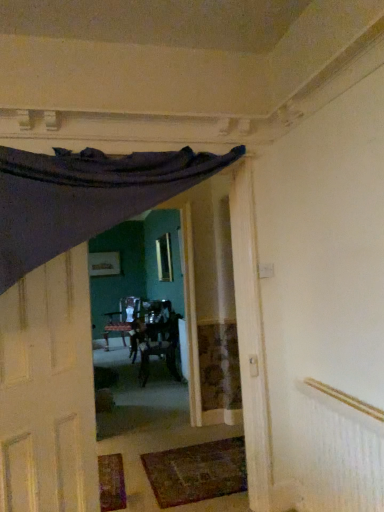
This screenshot has width=384, height=512. I want to click on clear glass window at center, so click(x=164, y=258).

What do you see at coordinates (342, 450) in the screenshot?
I see `white textured radiator at upper right` at bounding box center [342, 450].

I want to click on wooden textured chair at center, so click(156, 341).

Based on their sizes in the image, would you say white textured radiator at upper right is bigger or smaller than dark brown woven mat at lower center?

Clearly, white textured radiator at upper right is larger in size than dark brown woven mat at lower center.

Looking at this image, is white textured radiator at upper right not close to dark brown woven mat at lower center?

Yes, white textured radiator at upper right and dark brown woven mat at lower center are quite far apart.

You are a GUI agent. You are given a task and a screenshot of the screen. Output one action in this format:
    pyautogui.click(x=<x>, y=<y>)
    Task: Click on the mat below the white textured radiator at upper right (from the image's perspective)
    Image resolution: width=384 pixels, height=512 pixels.
    Given the screenshot: What is the action you would take?
    pyautogui.click(x=197, y=472)

Can you confirm if white textured radiator at upper right is thinner than dark brown woven mat at lower center?

Yes, white textured radiator at upper right is thinner than dark brown woven mat at lower center.

Which of these two, dark brown woven mat at lower center or white textured radiator at upper right, is wider?

dark brown woven mat at lower center.

From the image's perspective, which object appears higher, dark brown woven mat at lower center or white textured radiator at upper right?

white textured radiator at upper right.

Where is `mat below the white textured radiator at upper right (from a real-world perspective)`? The width and height of the screenshot is (384, 512). mat below the white textured radiator at upper right (from a real-world perspective) is located at coordinates (197, 472).

Consider the image. Looking at the image, does wooden textured chair at center seem bigger or smaller compared to dark brown woven mat at lower center?

In the image, wooden textured chair at center appears to be larger than dark brown woven mat at lower center.

From the image's perspective, who appears lower, wooden textured chair at center or dark brown woven mat at lower center?

dark brown woven mat at lower center appears lower in the image.

Is wooden textured chair at center outside of dark brown woven mat at lower center?

Indeed, wooden textured chair at center is completely outside dark brown woven mat at lower center.

Which object is more forward, wooden textured chair at center or dark brown woven mat at lower center?

dark brown woven mat at lower center is more forward.

How different are the orientations of matte white door at left and clear glass window at center in degrees?

matte white door at left and clear glass window at center are facing 134 degrees away from each other.

In the scene shown: Considering the sizes of objects matte white door at left and clear glass window at center in the image provided, who is taller, matte white door at left or clear glass window at center?

With more height is matte white door at left.

Which object is thinner, matte white door at left or clear glass window at center?

Thinner between the two is clear glass window at center.

Can you confirm if matte white door at left is bigger than clear glass window at center?

Yes, matte white door at left is bigger than clear glass window at center.

From the image's perspective, which one is positioned lower, clear glass window at center or dark brown woven mat at lower center?

From the image's view, dark brown woven mat at lower center is below.

Are clear glass window at center and dark brown woven mat at lower center located far from each other?

clear glass window at center is positioned a significant distance from dark brown woven mat at lower center.

Is dark brown woven mat at lower center inside clear glass window at center?

No, clear glass window at center does not contain dark brown woven mat at lower center.

Between clear glass window at center and wooden textured chair at center, which one has smaller width?

Thinner between the two is clear glass window at center.

Is point (171, 269) positioned in front of point (177, 318)?

No, (171, 269) is further to viewer.

From a real-world perspective, is clear glass window at center under wooden textured chair at center?

Actually, clear glass window at center is physically above wooden textured chair at center in the real world.

From the picture: Can you see clear glass window at center touching wooden textured chair at center?

No.

Is wooden textured chair at center at the back of matte white door at left?

No, matte white door at left is not facing the opposite direction of wooden textured chair at center.

Between matte white door at left and wooden textured chair at center, which one appears on the left side from the viewer's perspective?

matte white door at left.

Is matte white door at left inside or outside of wooden textured chair at center?

matte white door at left lies outside wooden textured chair at center.

Based on the photo, between matte white door at left and wooden textured chair at center, which one has smaller width?

Thinner between the two is matte white door at left.

Where is `mat behind the white textured radiator at upper right`? The height and width of the screenshot is (512, 384). mat behind the white textured radiator at upper right is located at coordinates (197, 472).

Identify the location of radiator above the dark brown woven mat at lower center (from the image's perspective). (342, 450).

Based on their spatial positions, is wooden textured chair at center or clear glass window at center further from dark brown woven mat at lower center?

Based on the image, clear glass window at center appears to be further to dark brown woven mat at lower center.

In the scene shown: Estimate the real-world distances between objects in this image. Which object is closer to matte white door at left, white textured radiator at upper right or wooden textured chair at center?

The object closer to matte white door at left is white textured radiator at upper right.

Looking at the image, which one is located closer to white textured radiator at upper right, dark brown woven mat at lower center or wooden textured chair at center?

dark brown woven mat at lower center lies closer to white textured radiator at upper right than the other object.

Based on their spatial positions, is matte white door at left or clear glass window at center closer to wooden textured chair at center?

Based on the image, clear glass window at center appears to be nearer to wooden textured chair at center.

Estimate the real-world distances between objects in this image. Which object is closer to wooden textured chair at center, white textured radiator at upper right or clear glass window at center?

clear glass window at center is closer to wooden textured chair at center.

Looking at this image, considering their positions, is dark brown woven mat at lower center positioned closer to white textured radiator at upper right than matte white door at left?

dark brown woven mat at lower center.

Estimate the real-world distances between objects in this image. Which object is further from clear glass window at center, dark brown woven mat at lower center or wooden textured chair at center?

dark brown woven mat at lower center is further to clear glass window at center.

Considering their positions, is dark brown woven mat at lower center positioned closer to white textured radiator at upper right than clear glass window at center?

dark brown woven mat at lower center is closer to white textured radiator at upper right.

Where is `mat between matte white door at left and white textured radiator at upper right`? mat between matte white door at left and white textured radiator at upper right is located at coordinates (197, 472).

Identify the location of door located between white textured radiator at upper right and clear glass window at center in the depth direction. The height and width of the screenshot is (512, 384). (48, 391).

Where is `mat positioned between white textured radiator at upper right and wooden textured chair at center from near to far`? The height and width of the screenshot is (512, 384). mat positioned between white textured radiator at upper right and wooden textured chair at center from near to far is located at coordinates (197, 472).

I want to click on mat positioned between white textured radiator at upper right and clear glass window at center from near to far, so click(x=197, y=472).